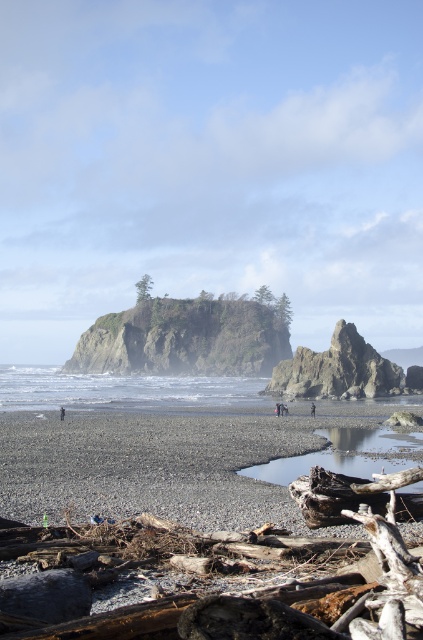
You are standing on the beach and see the smooth pebbles at lower left and the dark blue jeans at center. Which object is closer to you?

The smooth pebbles at lower left are closer to you because they are positioned over the dark blue jeans at center, indicating they are in front.

You are a photographer setting up equipment on the beach. You have a tripod that needs to be placed either near the rough textured rock formation at center or the dark gray fabric at lower left. Considering the height of these objects, which one would you choose to place the tripod next to if you want to ensure the tripod remains stable and doesn

The rough textured rock formation at center is much taller than the dark gray fabric at lower left, so placing the tripod next to the rough textured rock formation at center would provide a more stable base due to its height and possibly firmer ground compared to the fabric.

You are standing at the center of the beach and want to pick up the smooth pebbles at lower left. In which direction should you walk to reach them?

The smooth pebbles at lower left are located at point [156,465], so you should walk towards the lower left direction to reach them.